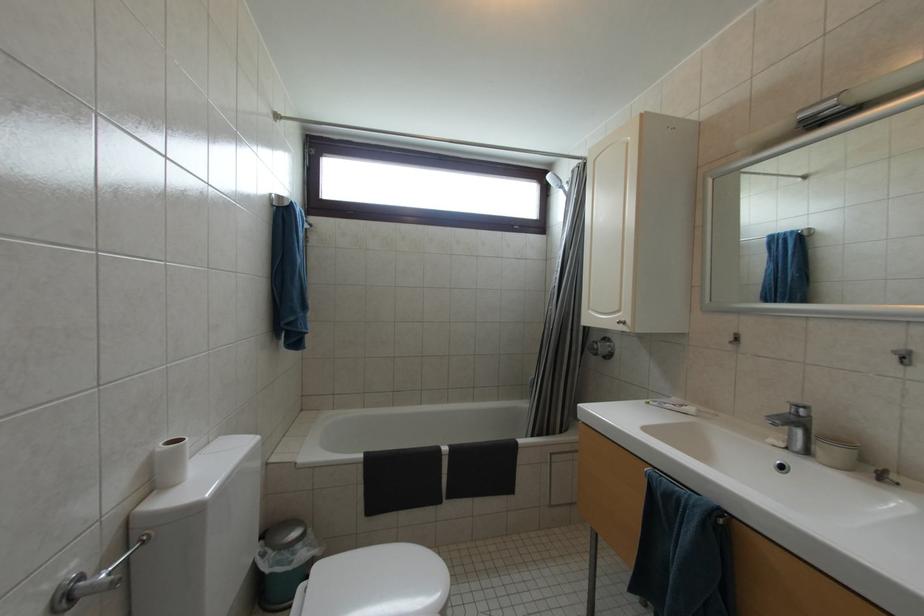
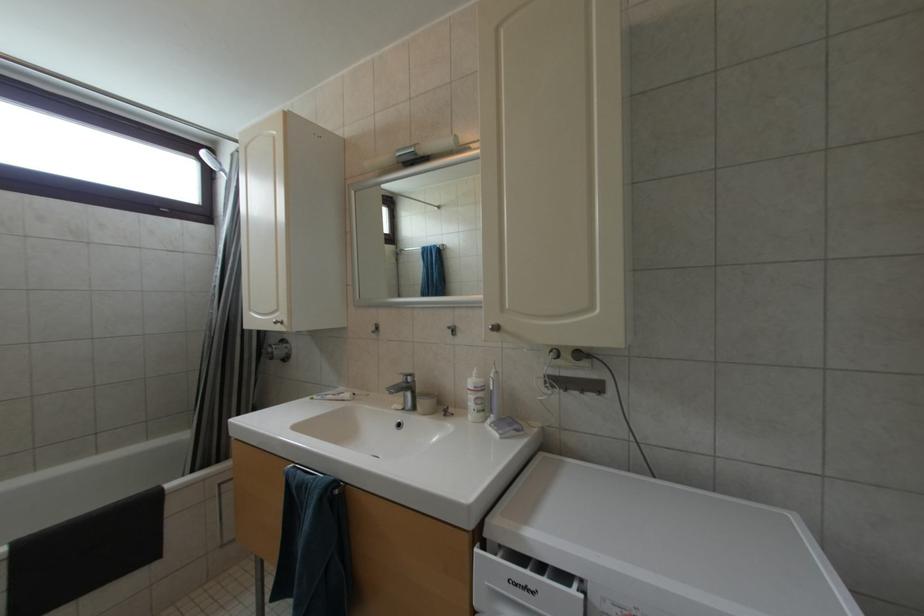
Question: The camera is either moving clockwise (left) or counter-clockwise (right) around the object. The first image is from the beginning of the video and the second image is from the end. Is the camera moving left or right when shooting the video?

Choices:
 (A) Left
 (B) Right

Answer: (A)